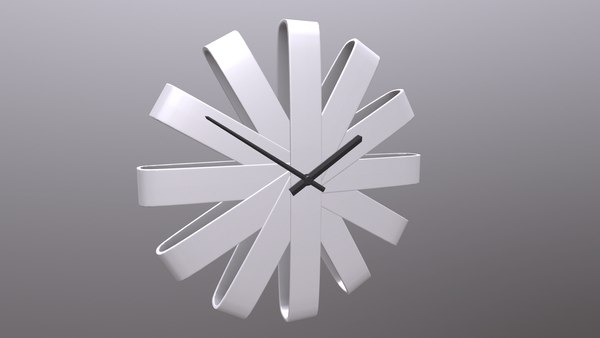
This screenshot has height=338, width=600. Identify the location of clock. (310, 70).